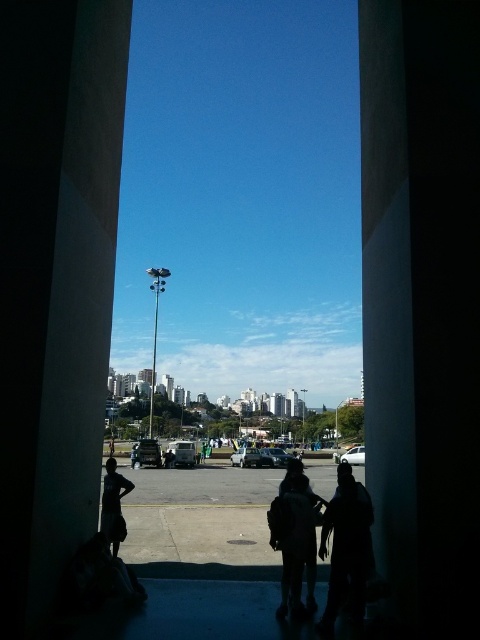
Is dark textured jacket at lower center to the left of dark fabric jacket at center from the viewer's perspective?

No, dark textured jacket at lower center is not to the left of dark fabric jacket at center.

Is dark textured jacket at lower center below dark fabric jacket at center?

Incorrect, dark textured jacket at lower center is not positioned below dark fabric jacket at center.

At what (x,y) coordinates should I click in order to perform the action: click on dark textured jacket at lower center. Please return your answer as a coordinate pair (x, y). The image size is (480, 640). Looking at the image, I should click on (347, 550).

Identify the location of dark textured jacket at lower center. (347, 550).

Is dark textured jacket at lower center positioned before dark gray hoodie at center?

Yes.

Is dark textured jacket at lower center further to the viewer compared to dark gray hoodie at center?

No, dark textured jacket at lower center is in front of dark gray hoodie at center.

Which is behind, point (362, 502) or point (131, 456)?

The point (131, 456) is more distant.

Where is `dark textured jacket at lower center`? dark textured jacket at lower center is located at coordinates (347, 550).

Between white glossy car at center and dark clothing figure at center, which one is positioned lower?

dark clothing figure at center is below.

What do you see at coordinates (354, 456) in the screenshot? Image resolution: width=480 pixels, height=640 pixels. I see `white glossy car at center` at bounding box center [354, 456].

Image resolution: width=480 pixels, height=640 pixels. Identify the location of white glossy car at center. (354, 456).

This screenshot has width=480, height=640. In order to click on white glossy car at center in this screenshot , I will do `click(354, 456)`.